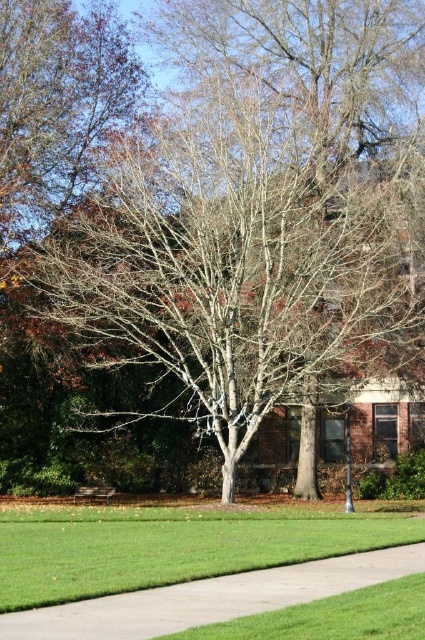
Question: Does gray concrete sidewalk at lower center have a greater width compared to wooden park bench at center?

Choices:
 (A) no
 (B) yes

Answer: (B)

Question: Which object is the closest to the gray concrete sidewalk at lower center?

Choices:
 (A) wooden park bench at center
 (B) bare branches at center

Answer: (B)

Question: Which object is closer to the camera taking this photo?

Choices:
 (A) wooden park bench at center
 (B) gray concrete sidewalk at lower center

Answer: (B)

Question: Does gray concrete sidewalk at lower center appear on the left side of wooden park bench at center?

Choices:
 (A) yes
 (B) no

Answer: (B)

Question: Is gray concrete sidewalk at lower center to the left of wooden park bench at center from the viewer's perspective?

Choices:
 (A) no
 (B) yes

Answer: (A)

Question: Which object is positioned farthest from the gray concrete sidewalk at lower center?

Choices:
 (A) wooden park bench at center
 (B) bare branches at center

Answer: (A)